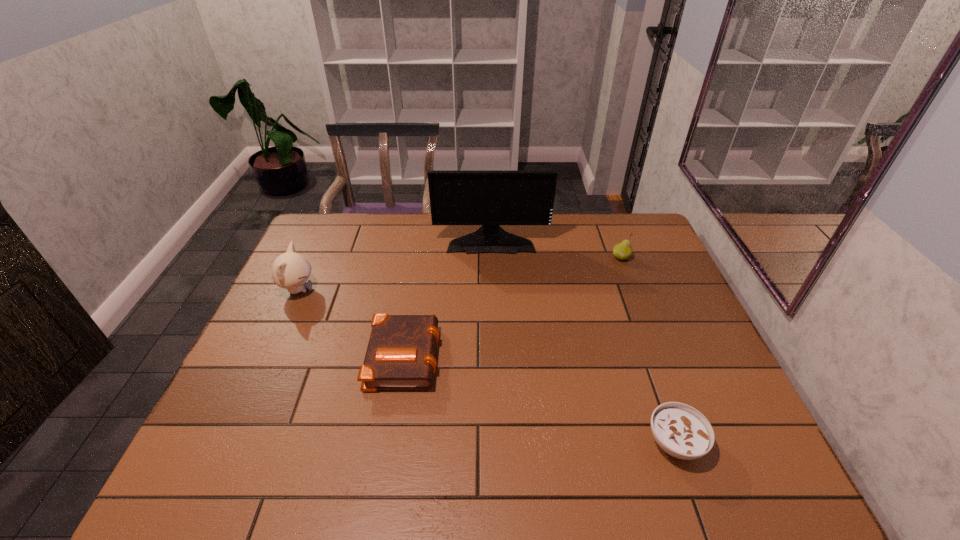
Identify the location of vacant space situated on the back of the soup bowl. The image size is (960, 540). (631, 318).

I want to click on monitor located in the far edge section of the desktop, so click(489, 198).

What are the coordinates of `pear present at the far edge` in the screenshot? It's located at (623, 250).

Where is `object located at the near edge`? object located at the near edge is located at coordinates (680, 430).

You are a GUI agent. You are given a task and a screenshot of the screen. Output one action in this format:
    pyautogui.click(x=<x>, y=<y>)
    Task: Click on the object located at the left edge
    
    Given the screenshot: What is the action you would take?
    pyautogui.click(x=290, y=270)

Locate an element on the screen. pear that is positioned at the right edge is located at coordinates (623, 250).

This screenshot has height=540, width=960. Identify the location of soup bowl present at the right edge. (680, 430).

This screenshot has width=960, height=540. In order to click on object that is at the far right corner in this screenshot , I will do `click(623, 250)`.

The width and height of the screenshot is (960, 540). Find the location of `object at the near right corner`. object at the near right corner is located at coordinates (680, 430).

Locate an element on the screen. This screenshot has width=960, height=540. vacant region at the far edge is located at coordinates (365, 214).